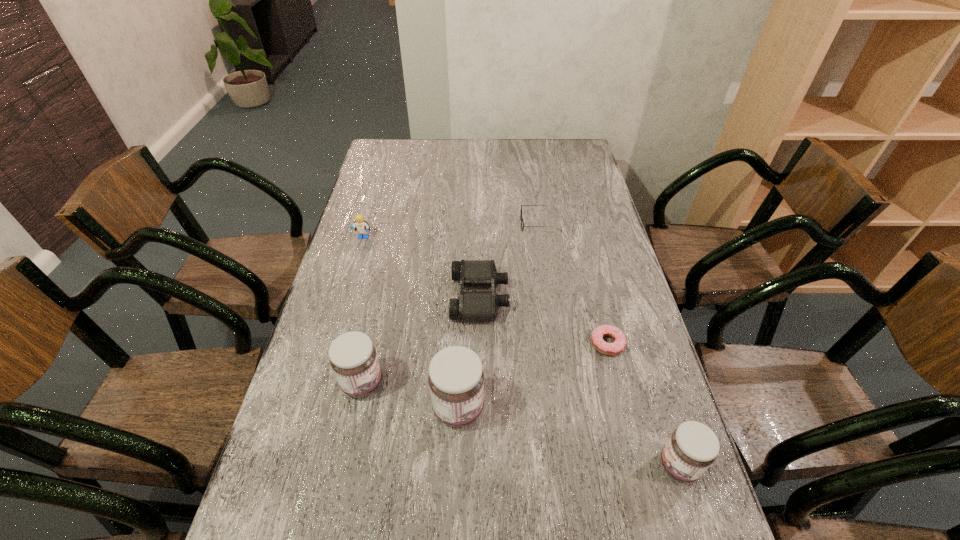
If the aim is uniform spacing by inserting an additional jam among them, please point to a vacant space for this new jam. Please provide its 2D coordinates. Your answer should be formatted as a tuple, i.e. [(x, y)], where the tuple contains the x and y coordinates of a point satisfying the conditions above.

[(564, 436)]